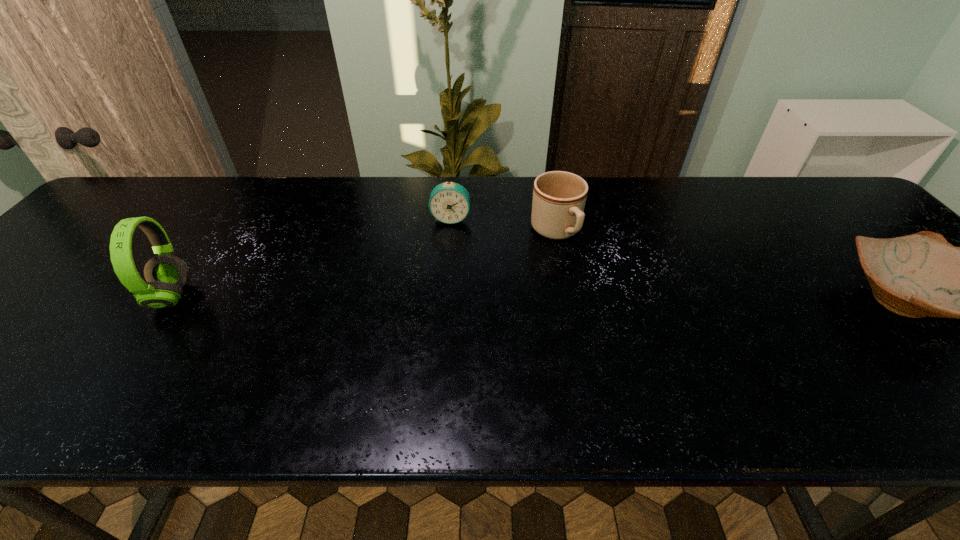
Where is `the tallest object`? The width and height of the screenshot is (960, 540). the tallest object is located at coordinates (166, 274).

Identify the location of headset. (166, 274).

Find the location of a particular element. Image resolution: width=960 pixels, height=540 pixels. the second object from right to left is located at coordinates (559, 197).

Image resolution: width=960 pixels, height=540 pixels. What are the coordinates of `the second object from left to right` in the screenshot? It's located at 449,202.

Locate an element on the screen. Image resolution: width=960 pixels, height=540 pixels. vacant space situated 0.260m on the back of the tallest object is located at coordinates (232, 210).

Identify the location of vacant space located on the side of the second object from right to left with the handle. The width and height of the screenshot is (960, 540). (638, 343).

The width and height of the screenshot is (960, 540). What are the coordinates of `free space located on the side of the second object from right to left with the handle` in the screenshot? It's located at (592, 282).

Where is `vacant space situated on the side of the second object from right to left with the handle`? This screenshot has height=540, width=960. vacant space situated on the side of the second object from right to left with the handle is located at coordinates (665, 378).

Where is `vacant region located 0.370m on the front-facing side of the alarm clock`? Image resolution: width=960 pixels, height=540 pixels. vacant region located 0.370m on the front-facing side of the alarm clock is located at coordinates (433, 332).

Where is `blank space located on the front-facing side of the alarm clock`? This screenshot has height=540, width=960. blank space located on the front-facing side of the alarm clock is located at coordinates (438, 301).